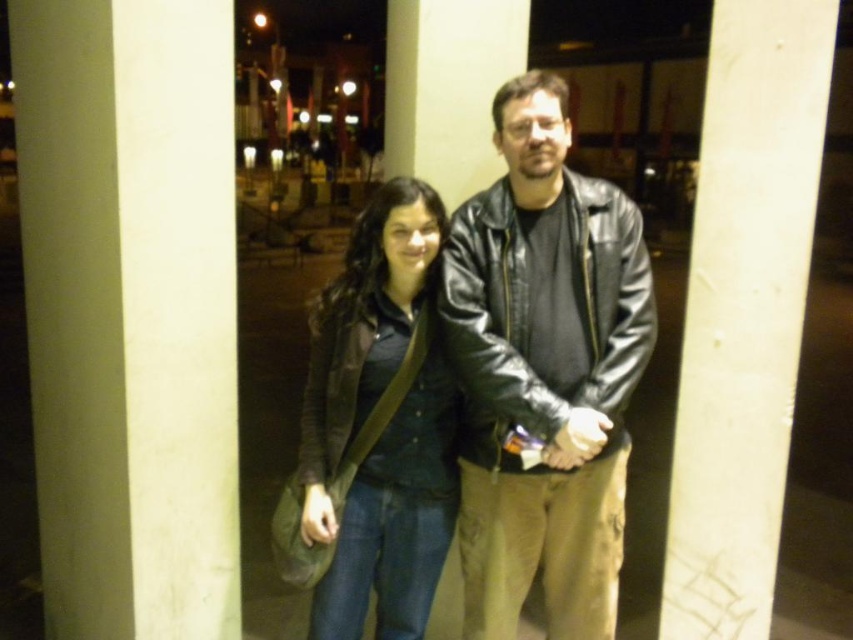
Question: Considering the relative positions of black leather jacket at center and white smooth pillar at center in the image provided, where is black leather jacket at center located with respect to white smooth pillar at center?

Choices:
 (A) right
 (B) left

Answer: (B)

Question: Which point is closer to the camera?

Choices:
 (A) white smooth pillar at left
 (B) black leather jacket at center
 (C) white smooth pillar at center
 (D) matte brown jacket at center

Answer: (A)

Question: Is black leather jacket at center wider than matte brown jacket at center?

Choices:
 (A) yes
 (B) no

Answer: (A)

Question: Which object is the closest to the white smooth pillar at center?

Choices:
 (A) white smooth pillar at left
 (B) black leather jacket at center

Answer: (B)

Question: Can you confirm if white smooth pillar at left is positioned below matte brown jacket at center?

Choices:
 (A) yes
 (B) no

Answer: (B)

Question: Which point appears farthest from the camera in this image?

Choices:
 (A) (165, 314)
 (B) (535, 326)

Answer: (B)